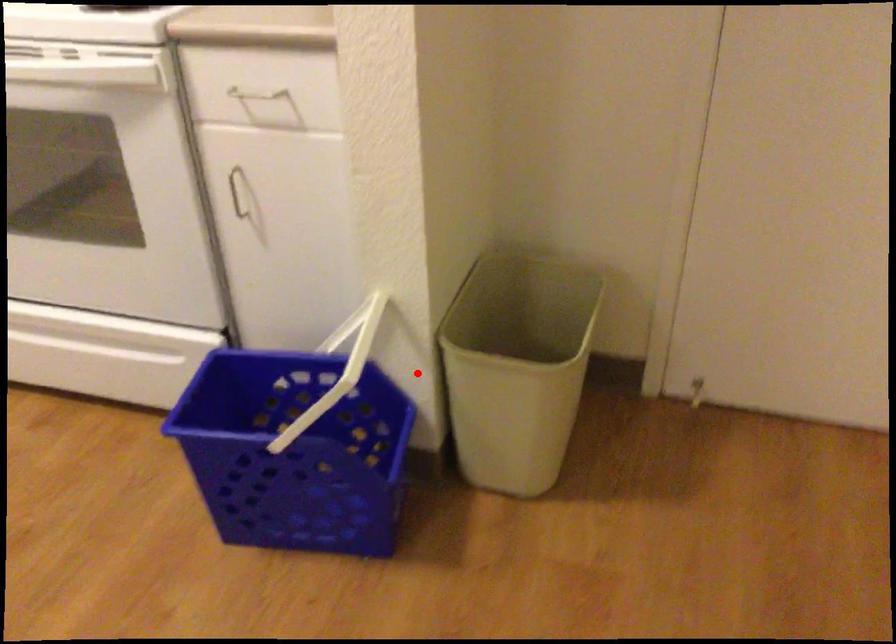
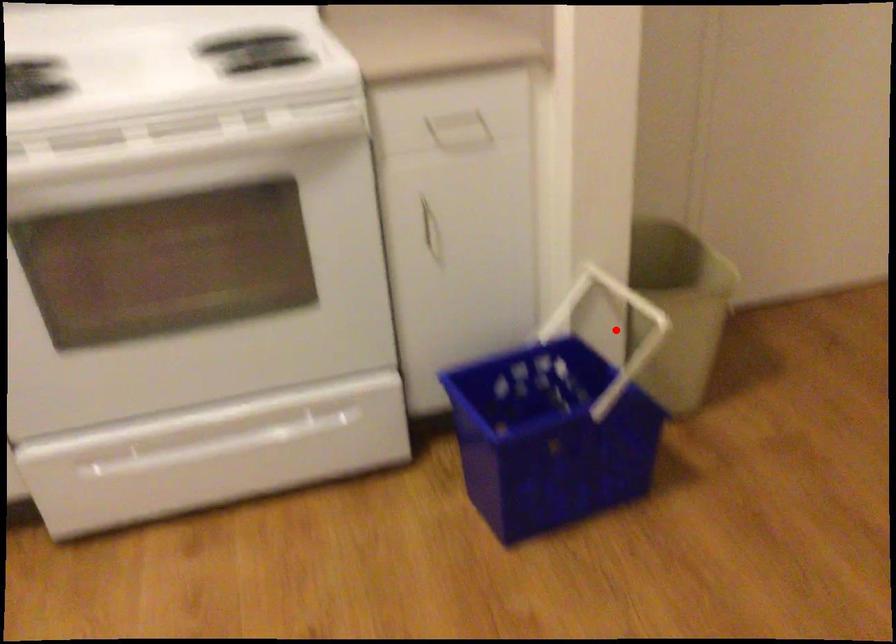
I am providing you with two images of the same scene from different viewpoints. A red point is marked on the first image and another point is marked on the second image. Are the points marked in image1 and image2 representing the same 3D position?

Yes